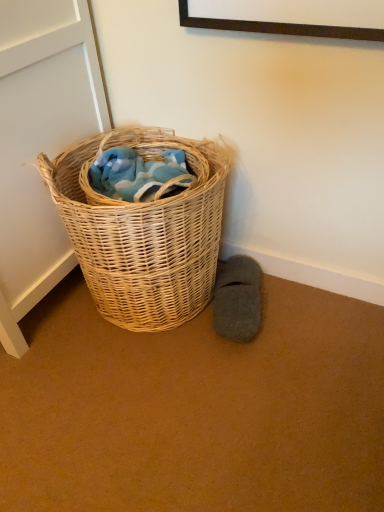
Question: Is gray felt slipper at lower right looking in the opposite direction of woven natural basket at lower left?

Choices:
 (A) no
 (B) yes

Answer: (B)

Question: Is gray felt slipper at lower right not close to woven natural basket at lower left?

Choices:
 (A) no
 (B) yes

Answer: (A)

Question: From the image's perspective, is gray felt slipper at lower right below woven natural basket at lower left?

Choices:
 (A) no
 (B) yes

Answer: (B)

Question: Is gray felt slipper at lower right further to camera compared to woven natural basket at lower left?

Choices:
 (A) no
 (B) yes

Answer: (B)

Question: Is gray felt slipper at lower right to the right of woven natural basket at lower left from the viewer's perspective?

Choices:
 (A) yes
 (B) no

Answer: (A)

Question: From the image's perspective, is gray felt slipper at lower right over woven natural basket at lower left?

Choices:
 (A) no
 (B) yes

Answer: (A)

Question: From a real-world perspective, is woven natural basket at lower left located beneath gray felt slipper at lower right?

Choices:
 (A) yes
 (B) no

Answer: (B)

Question: Does woven natural basket at lower left have a lesser height compared to gray felt slipper at lower right?

Choices:
 (A) no
 (B) yes

Answer: (A)

Question: Is the surface of woven natural basket at lower left in direct contact with gray felt slipper at lower right?

Choices:
 (A) yes
 (B) no

Answer: (B)

Question: From the image's perspective, would you say woven natural basket at lower left is shown under gray felt slipper at lower right?

Choices:
 (A) no
 (B) yes

Answer: (A)

Question: Would you say woven natural basket at lower left contains gray felt slipper at lower right?

Choices:
 (A) no
 (B) yes

Answer: (A)

Question: Does woven natural basket at lower left have a greater width compared to gray felt slipper at lower right?

Choices:
 (A) yes
 (B) no

Answer: (A)

Question: In the image, is woven natural basket at lower left positioned in front of or behind gray felt slipper at lower right?

Choices:
 (A) front
 (B) behind

Answer: (A)